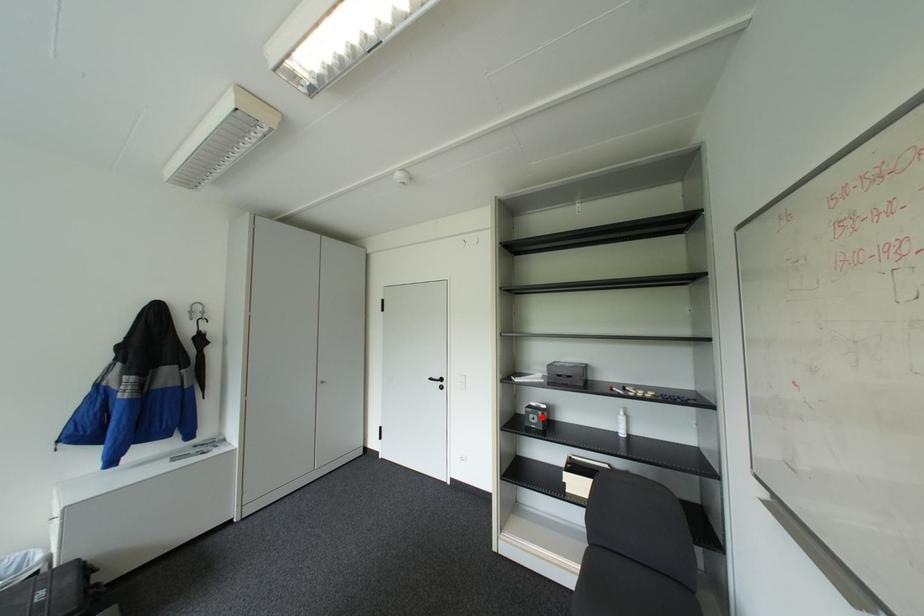
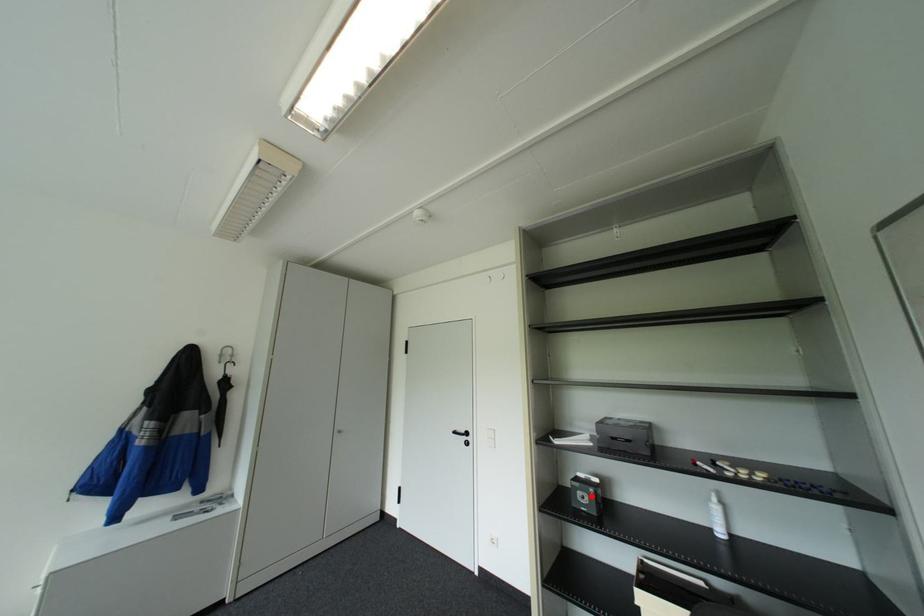
I am providing you with two images of the same scene from different viewpoints. A red point is marked on the first image and another point is marked on the second image. Does the point marked in image1 correspond to the same location as the one in image2?

Yes